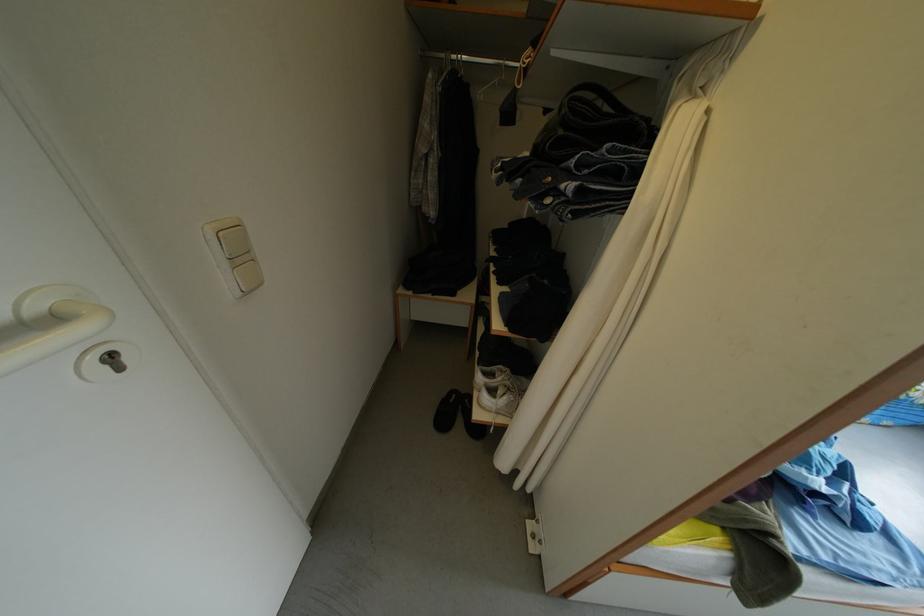
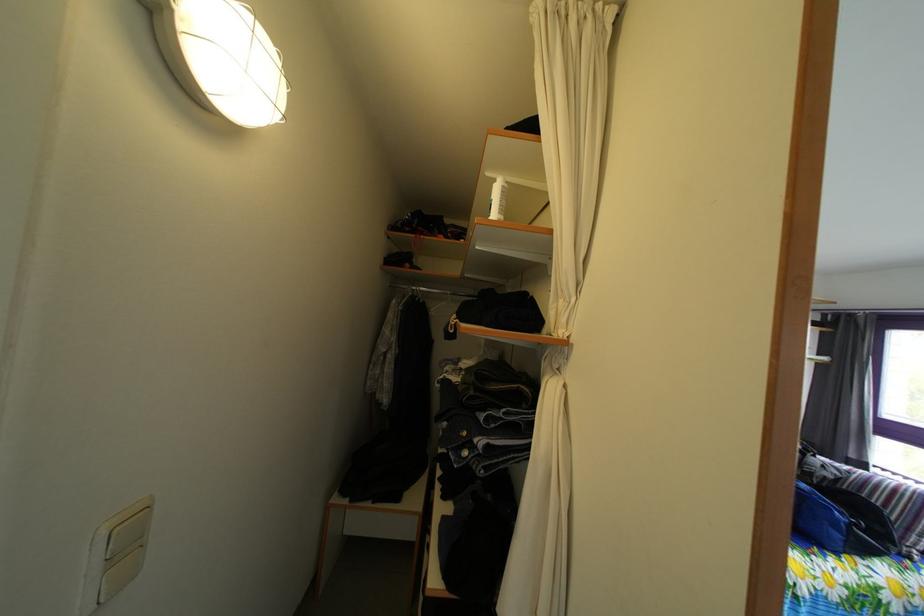
Locate, in the second image, the point that corresponds to (455,63) in the first image.

(418, 294)